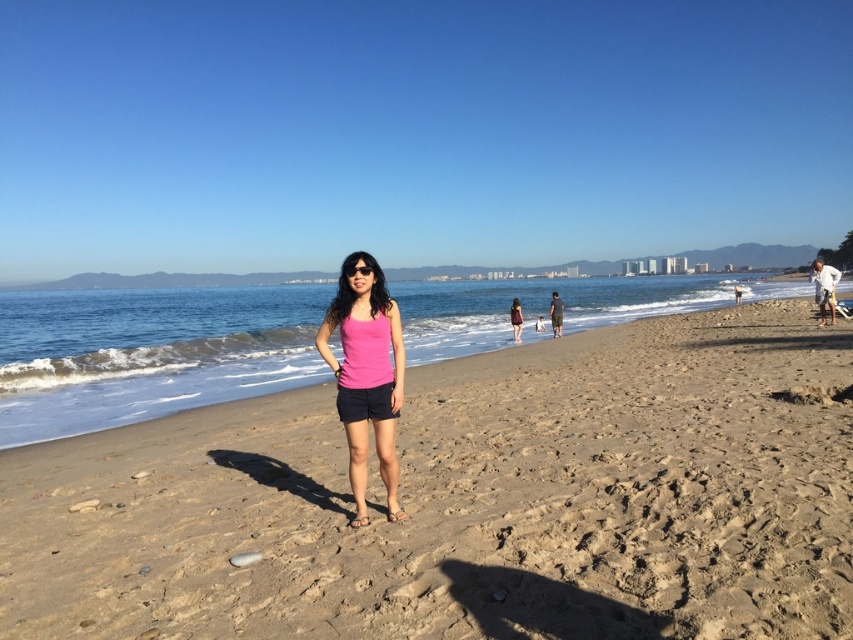
You are a photographer who wants to capture the pink fabric tank top at center and the light brown sandy beach at center in the same frame. Based on their positions, which object should you focus on first to ensure both are in focus?

The light brown sandy beach at center is located below the pink fabric tank top at center, so you should focus on the pink fabric tank top at center first to ensure both are in focus since it is closer to the camera.

Looking at this image, you are a photographer trying to capture the light brown sandy beach at center and the pink fabric tank top at center in a single shot. Based on their positions, which object will appear closer to the camera in the photo?

The light brown sandy beach at center appears closer to the camera because it is positioned in front of the pink fabric tank top at center.

You are a photographer trying to capture the entire beach scene. You need to place your tripod at a specific coordinate to ensure the light brown sandy beach at center is perfectly framed. What are the coordinates where you should place your tripod?

The light brown sandy beach at center is located at coordinates point [469,500], so you should place your tripod at that coordinate to frame it perfectly.